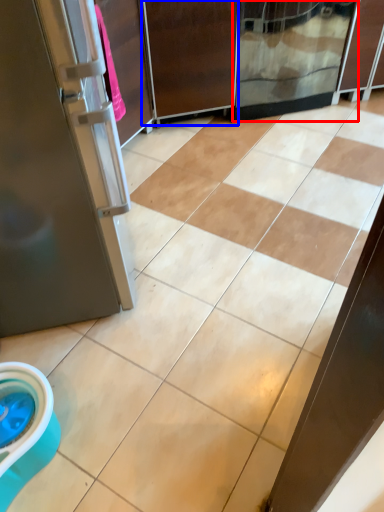
Question: Which point is further to the camera, screen door (highlighted by a red box) or screen door (highlighted by a blue box)?

Choices:
 (A) screen door
 (B) screen door

Answer: (A)